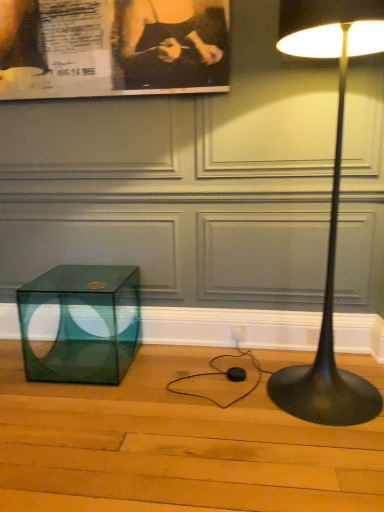
I want to click on vacant region to the left of black matte floor lamp at right, so click(x=220, y=408).